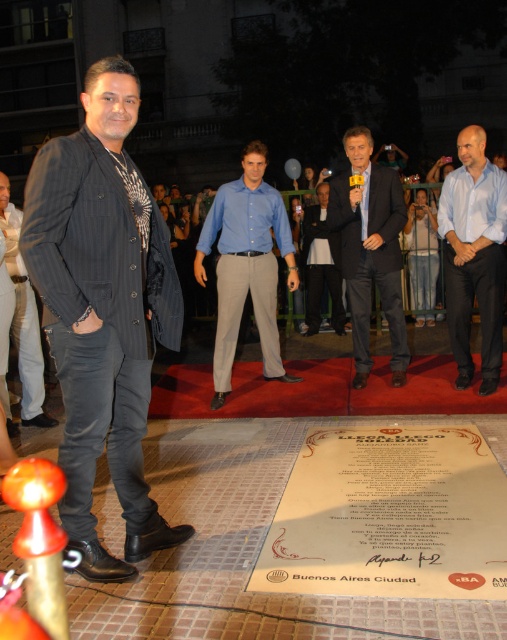
Who is higher up, dark pinstripe suit at left or blue cotton shirt at center?

blue cotton shirt at center is above.

Between dark pinstripe suit at left and blue cotton shirt at center, which one has less height?

Standing shorter between the two is dark pinstripe suit at left.

Between point (151, 292) and point (215, 404), which one is positioned in front?

Point (151, 292) is in front.

What are the coordinates of `dark pinstripe suit at left` in the screenshot? It's located at (102, 310).

Who is lower down, blue cotton shirt at center or dark gray wool suit at center?

blue cotton shirt at center

Is point (233, 348) less distant than point (312, 326)?

Yes, it is.

Locate an element on the screen. blue cotton shirt at center is located at coordinates coord(246,266).

Find the location of a particular element. blue cotton shirt at center is located at coordinates (246, 266).

Is dark pinstripe suit at left bigger than matte black jacket at center?

Actually, dark pinstripe suit at left might be smaller than matte black jacket at center.

Where is `dark pinstripe suit at left`? This screenshot has height=640, width=507. dark pinstripe suit at left is located at coordinates (102, 310).

Does point (65, 321) come in front of point (2, 179)?

Yes, it is in front of point (2, 179).

Image resolution: width=507 pixels, height=640 pixels. Find the location of `dark pinstripe suit at left`. dark pinstripe suit at left is located at coordinates (102, 310).